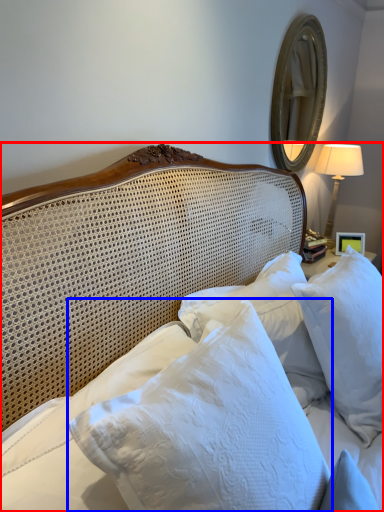
Question: Which of the following is the closest to the observer, bed (highlighted by a red box) or pillow (highlighted by a blue box)?

Choices:
 (A) bed
 (B) pillow

Answer: (A)